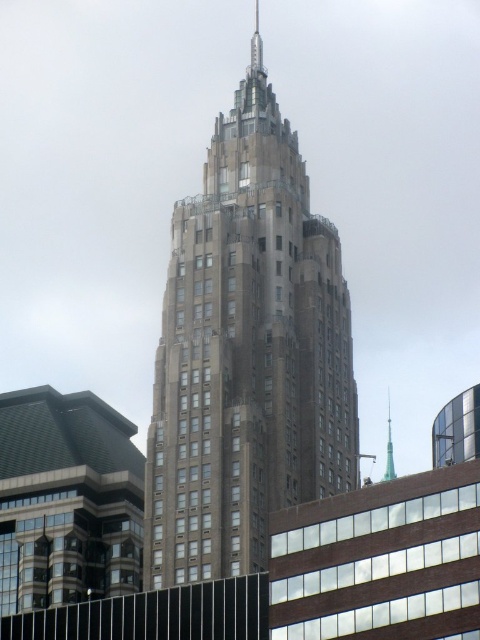
You are an urban planner assessing the view of the city skyline. You notice the brown stone tower at center and the green glass spire at upper center. Which structure would block the view of the other when looking from the east side of the city?

The brown stone tower at center is in front of the green glass spire at upper center, so it would block the view of the green glass spire at upper center when viewed from the east side.

You are an architect analyzing the building structure. Based on the image, which of the two elements, the brown stone tower at center or the green glass spire at upper center, contributes more to the building height?

The brown stone tower at center is much taller than the green glass spire at upper center, so it contributes more to the building height.